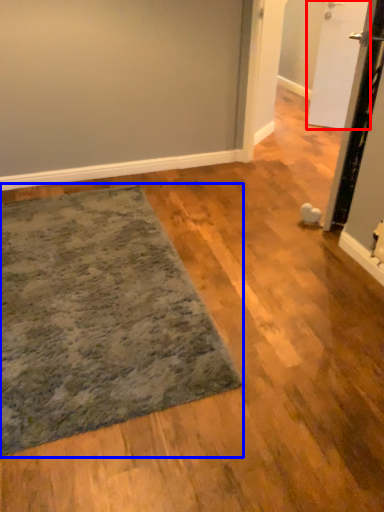
Question: Which of the following is the closest to the observer, door (highlighted by a red box) or mat (highlighted by a blue box)?

Choices:
 (A) door
 (B) mat

Answer: (B)